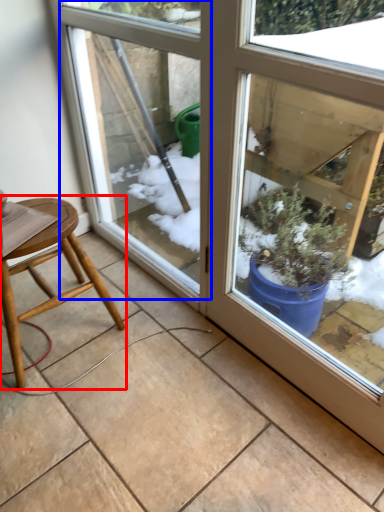
Question: Which object appears closest to the camera in this image, stool (highlighted by a red box) or screen door (highlighted by a blue box)?

Choices:
 (A) stool
 (B) screen door

Answer: (B)